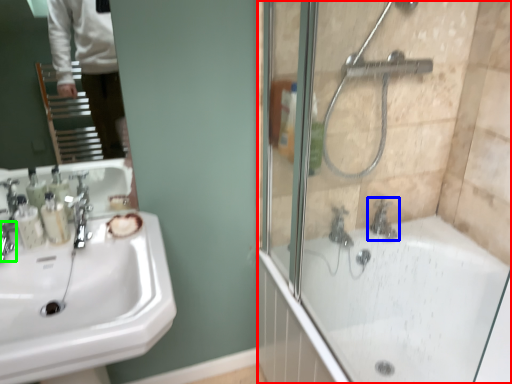
Question: Estimate the real-world distances between objects in this image. Which object is closer to screen door (highlighted by a red box), tap (highlighted by a blue box) or faucet (highlighted by a green box)?

Choices:
 (A) tap
 (B) faucet

Answer: (A)